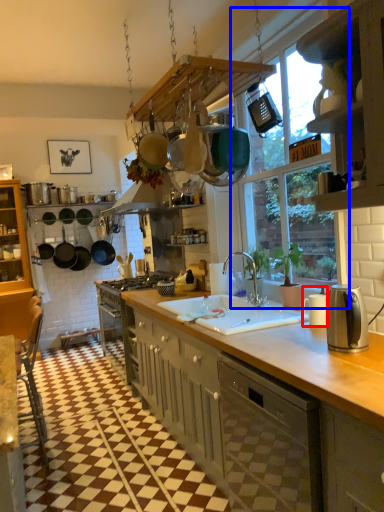
Question: Which point is closer to the camera, appliance (highlighted by a red box) or window (highlighted by a blue box)?

Choices:
 (A) appliance
 (B) window

Answer: (B)